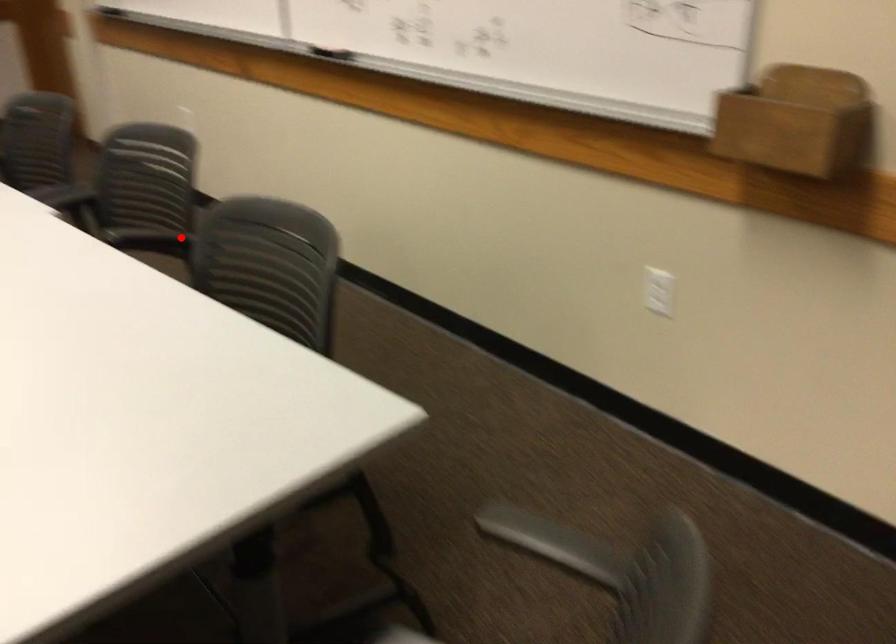
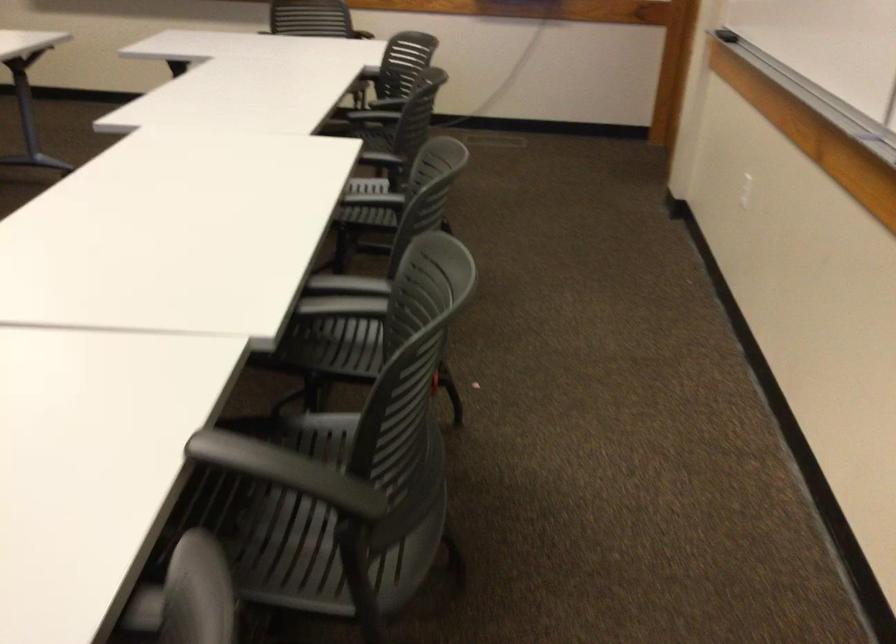
Question: I am providing you with two images of the same scene from different viewpoints. Image1 has a red point marked. In image2, the corresponding 3D location appears at what relative position? Reply with the corresponding letter.

Choices:
 (A) Closer
 (B) Farther

Answer: (A)